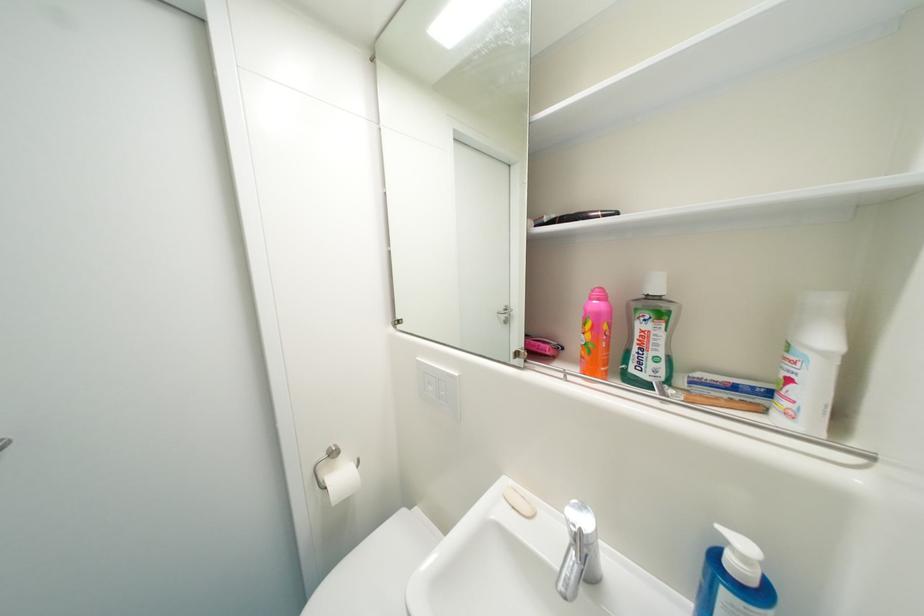
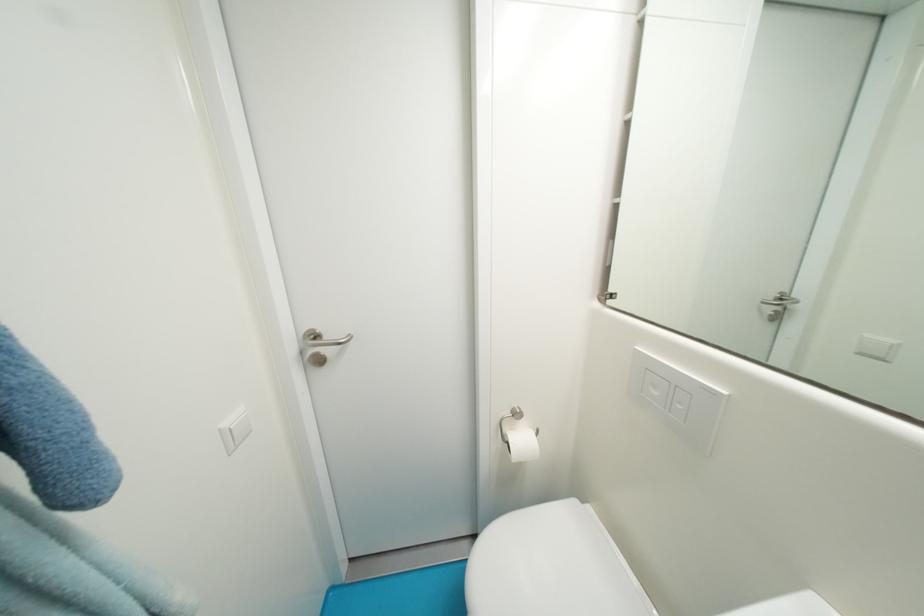
Locate, in the second image, the point that corresponds to the point at 349,479 in the first image.

(529, 442)